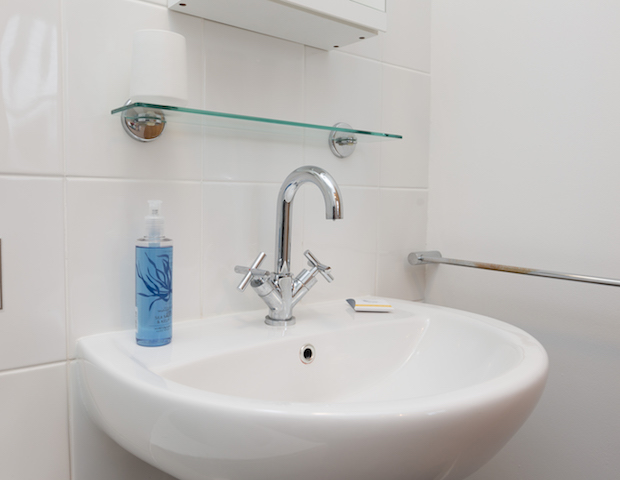
The width and height of the screenshot is (620, 480). In order to click on the left handle of faucet in this screenshot , I will do `click(252, 272)`.